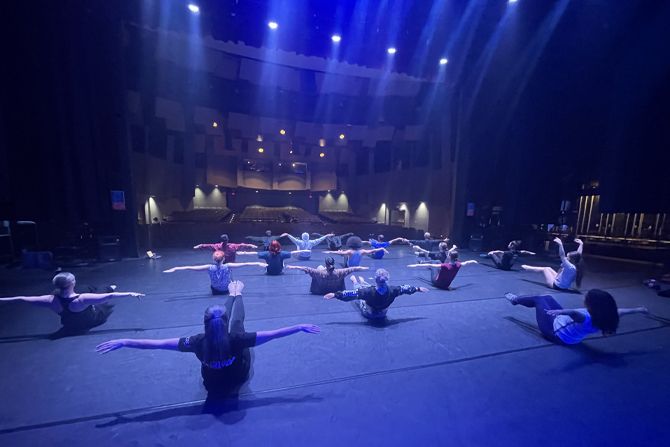
You are a GUI agent. You are given a task and a screenshot of the screen. Output one action in this format:
    pyautogui.click(x=<x>, y=<y>)
    Task: Click on the theatre seating
    The height and width of the screenshot is (447, 670).
    Given the screenshot: What is the action you would take?
    pyautogui.click(x=269, y=220), pyautogui.click(x=186, y=234), pyautogui.click(x=344, y=218)